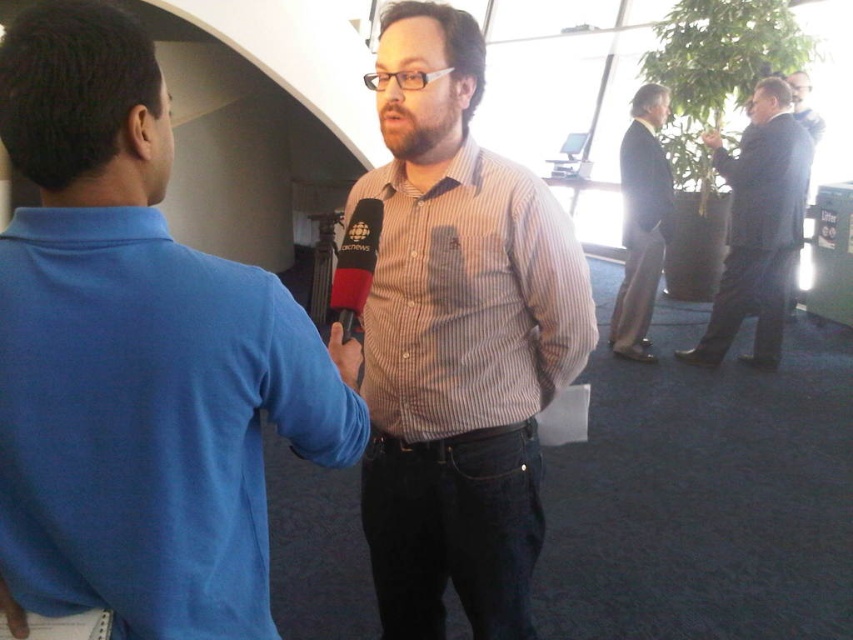
Question: Is brown striped shirt at center wider than red fabric microphone at center?

Choices:
 (A) yes
 (B) no

Answer: (A)

Question: Which point appears farthest from the camera in this image?

Choices:
 (A) (372, 237)
 (B) (451, 397)

Answer: (B)

Question: Does brown striped shirt at center have a larger size compared to dark brown suit at upper right?

Choices:
 (A) no
 (B) yes

Answer: (A)

Question: Estimate the real-world distances between objects in this image. Which object is closer to the blue cotton shirt at center?

Choices:
 (A) striped cotton shirt at center
 (B) red fabric microphone at center
 (C) brown striped shirt at center

Answer: (B)

Question: Is dark brown suit at upper right positioned at the back of matte black microphone at center?

Choices:
 (A) no
 (B) yes

Answer: (B)

Question: Which is nearer to the red fabric microphone at center?

Choices:
 (A) brown striped shirt at center
 (B) striped cotton shirt at center

Answer: (A)